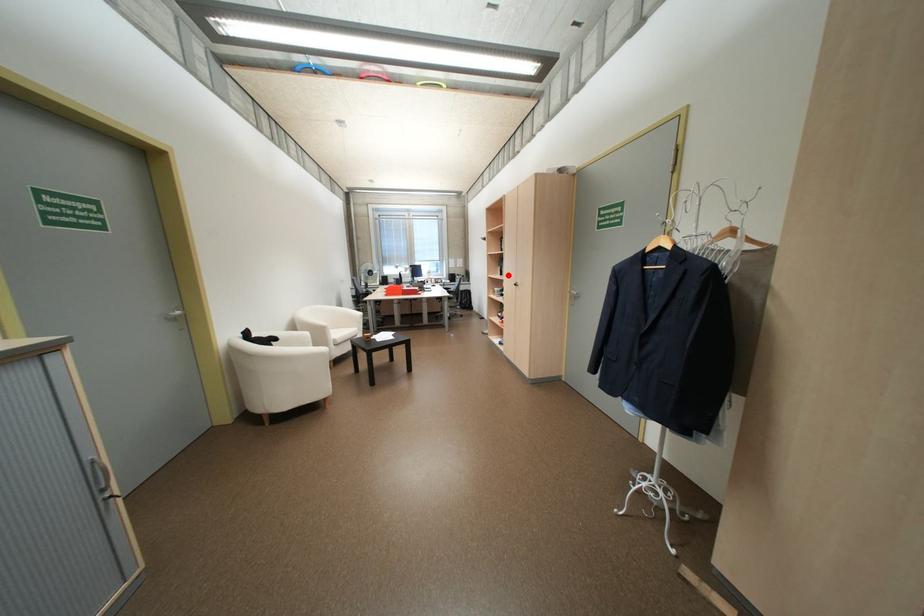
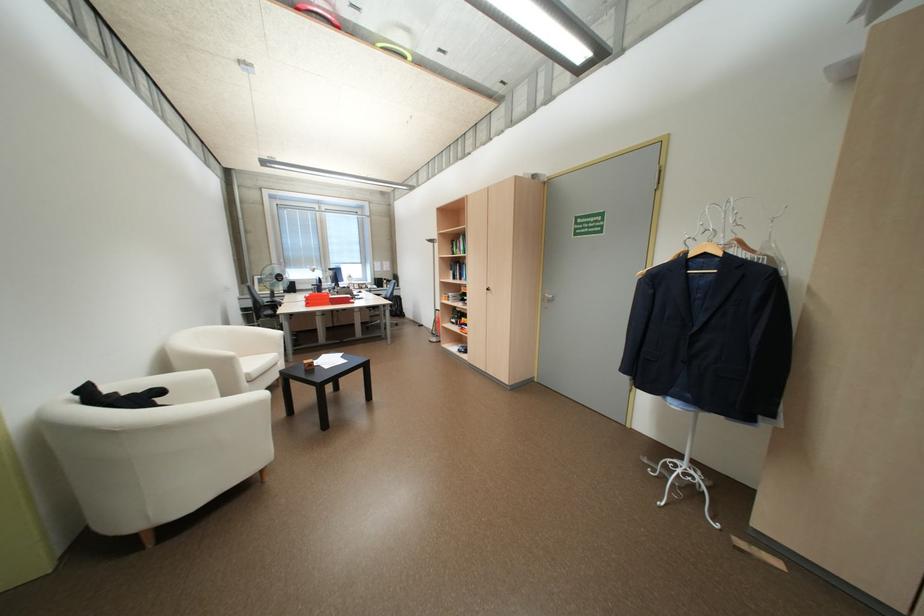
Find the pixel in the second image that matches the highlighted location in the first image.

(460, 280)